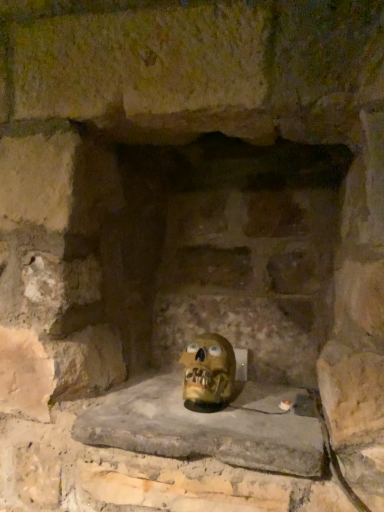
Where is `free point above smooth stone window sill at center (from a real-world perspective)`? free point above smooth stone window sill at center (from a real-world perspective) is located at coordinates (197, 403).